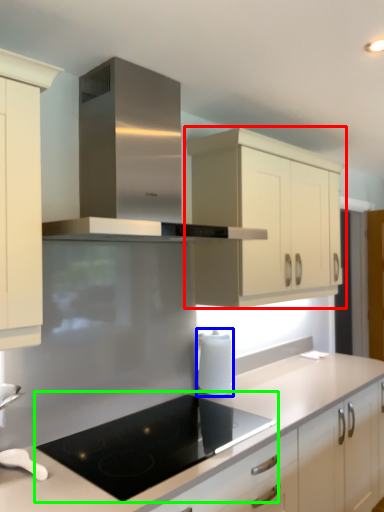
Question: Which is farther away from cabinetry (highlighted by a red box)? kitchen appliance (highlighted by a blue box) or gas stove (highlighted by a green box)?

Choices:
 (A) kitchen appliance
 (B) gas stove

Answer: (B)